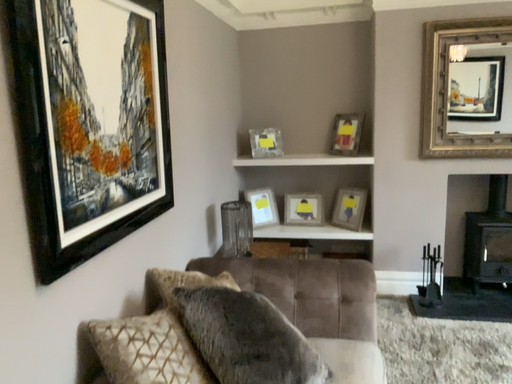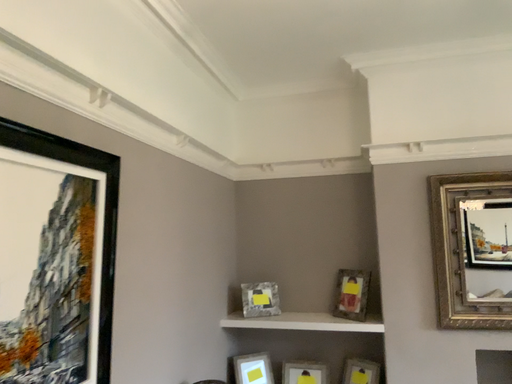
Question: Which way did the camera rotate in the video?

Choices:
 (A) rotated downward
 (B) rotated upward

Answer: (B)